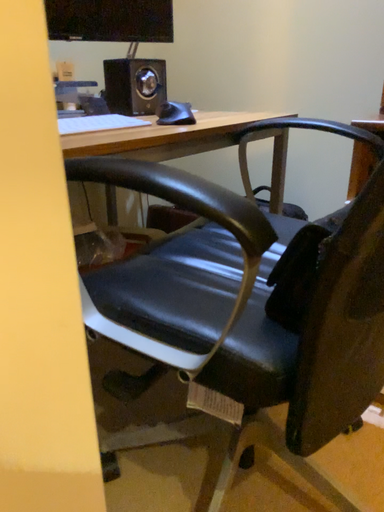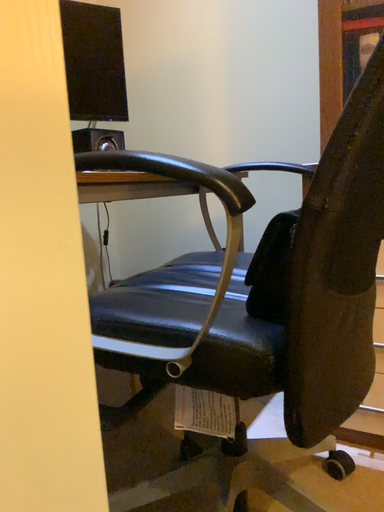
Question: How did the camera likely rotate when shooting the video?

Choices:
 (A) rotated upward
 (B) rotated downward

Answer: (A)